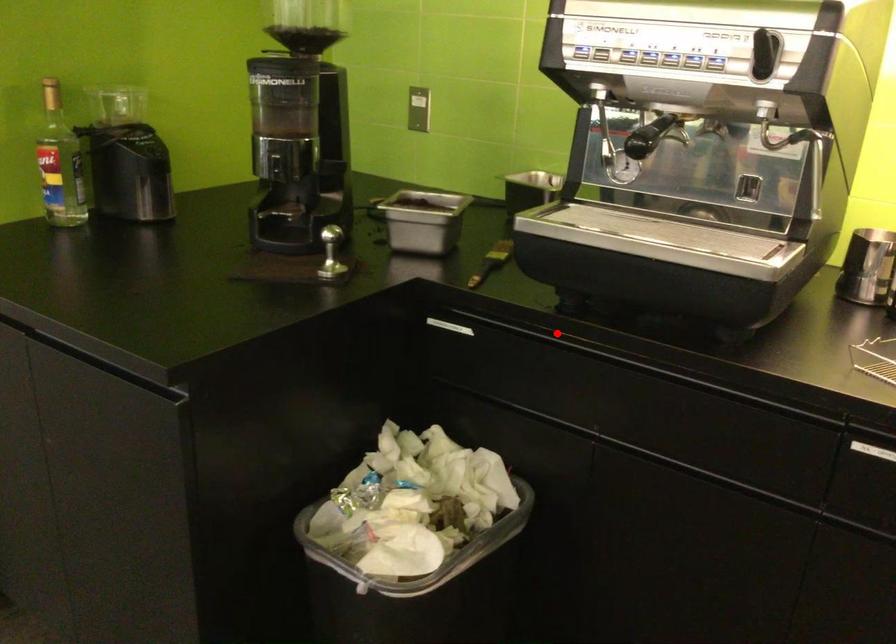
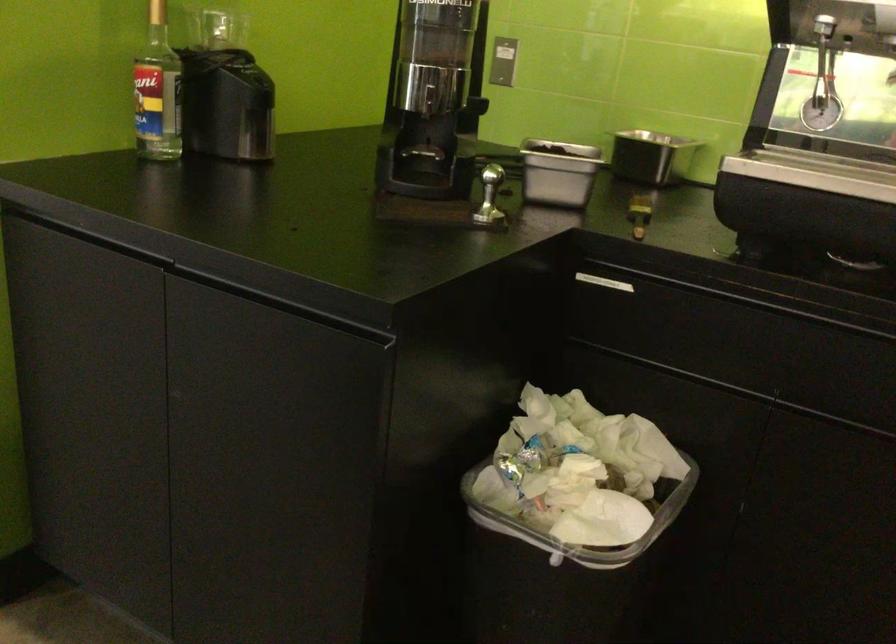
Locate, in the second image, the point that corresponds to the highlighted location in the first image.

(744, 287)